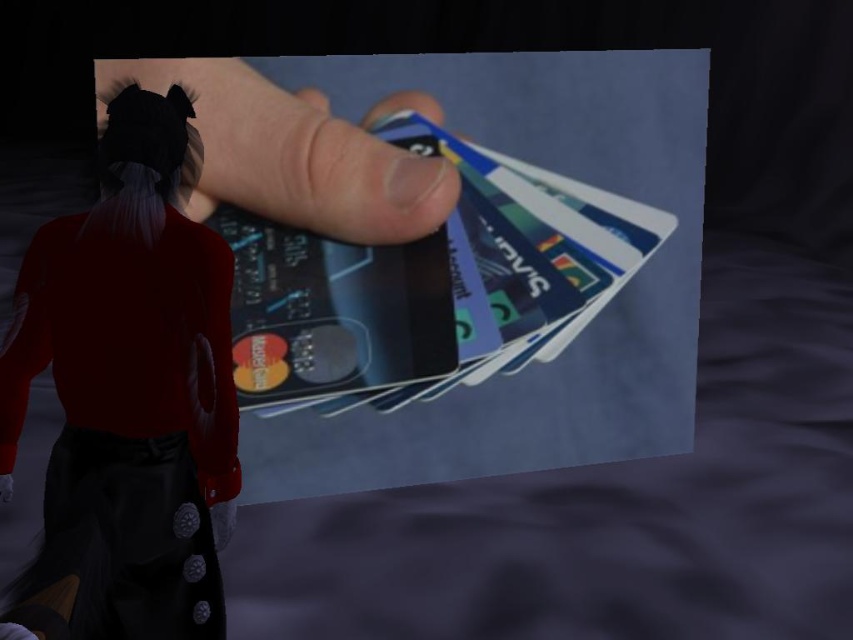
You are a security guard checking the size of objects in the scene. Which object is larger between the smooth skin hand at center and the metallic blue credit card at center?

The smooth skin hand at center is bigger than the metallic blue credit card at center according to the description.

You are an observer looking at the image. You notice the silky black hair at upper left and the smooth skin hand at center. Which object is positioned higher in the frame?

The smooth skin hand at center is positioned higher in the frame than the silky black hair at upper left.